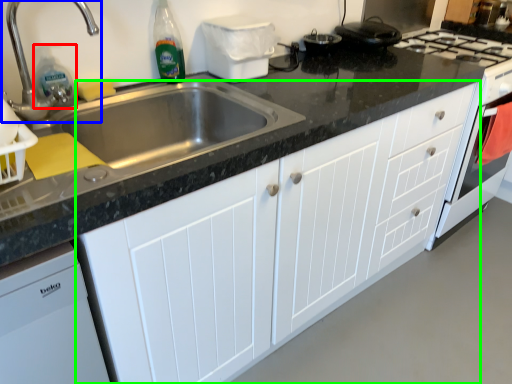
Question: Which object is the closest to the cleaning product (highlighted by a red box)? Choose among these: tap (highlighted by a blue box) or cabinetry (highlighted by a green box).

Choices:
 (A) tap
 (B) cabinetry

Answer: (A)